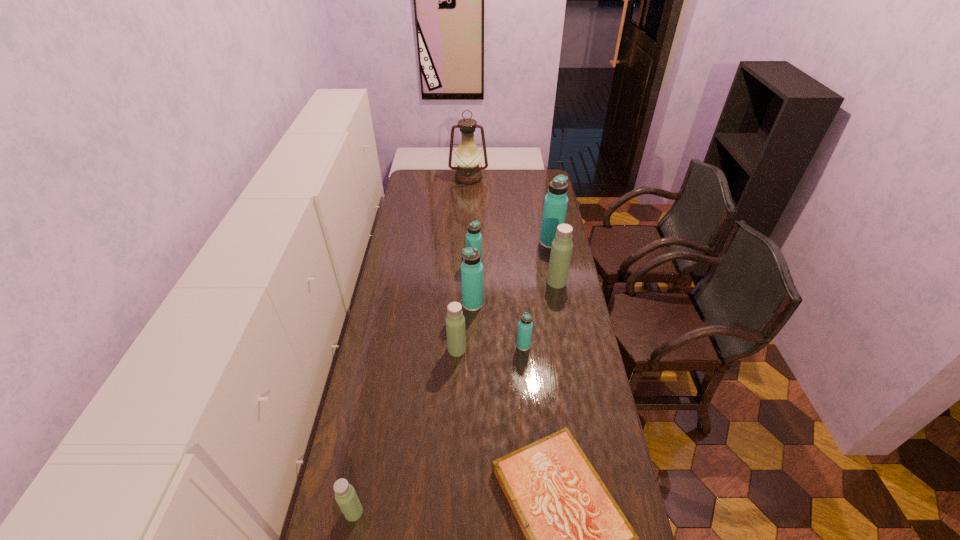
Where is `vacant region between the second farthest thermos bottle and the farthest light thermos bottle`? This screenshot has width=960, height=540. vacant region between the second farthest thermos bottle and the farthest light thermos bottle is located at coordinates (516, 273).

Find the location of a particular element. The height and width of the screenshot is (540, 960). vacant space in between the second farthest light thermos bottle and the smallest light thermos bottle is located at coordinates (405, 431).

The image size is (960, 540). What are the coordinates of `free space between the third thermos bottle from right to left and the second nearest light thermos bottle` in the screenshot? It's located at (491, 348).

The image size is (960, 540). What are the coordinates of `empty location between the sixth nearest thermos bottle and the fifth thermos bottle from left to right` in the screenshot? It's located at (499, 306).

This screenshot has height=540, width=960. I want to click on vacant space that is in between the second nearest aqua thermos bottle and the smallest light thermos bottle, so click(x=413, y=408).

I want to click on object that can be found as the third closest to the second nearest aqua thermos bottle, so click(x=525, y=326).

Locate an element on the screen. Image resolution: width=960 pixels, height=540 pixels. object that is the seventh nearest to the rightmost light thermos bottle is located at coordinates (x=467, y=155).

At what (x,y) coordinates should I click in order to perform the action: click on thermos bottle that is the third closest to the third farthest thermos bottle. Please return your answer as a coordinate pair (x, y). Looking at the image, I should click on (473, 237).

Where is `thermos bottle that stands as the fifth closest to the shortest object`? This screenshot has width=960, height=540. thermos bottle that stands as the fifth closest to the shortest object is located at coordinates (561, 250).

Where is `aqua thermos bottle that stands as the third closest to the third nearest aqua thermos bottle`? aqua thermos bottle that stands as the third closest to the third nearest aqua thermos bottle is located at coordinates (525, 326).